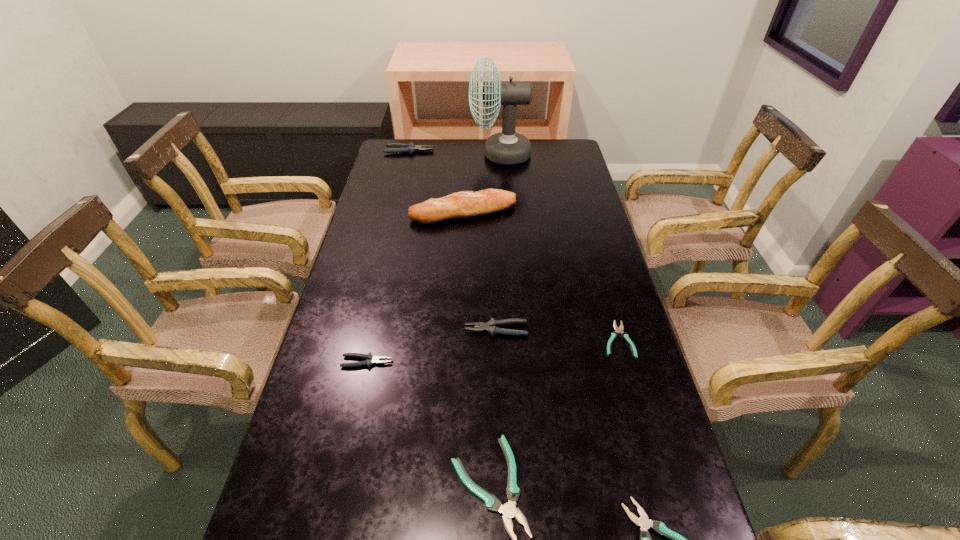
At what (x,y) coordinates should I click in order to perform the action: click on the tallest object. Please return your answer as a coordinate pair (x, y). The width and height of the screenshot is (960, 540). Looking at the image, I should click on (507, 147).

Identify the location of the second tallest object. The height and width of the screenshot is (540, 960). (464, 204).

You are a GUI agent. You are given a task and a screenshot of the screen. Output one action in this format:
    pyautogui.click(x=<x>, y=<y>)
    Task: Click on the baguet
    The width and height of the screenshot is (960, 540).
    Given the screenshot: What is the action you would take?
    pyautogui.click(x=464, y=204)

Locate an element on the screen. The width and height of the screenshot is (960, 540). the third tallest object is located at coordinates (396, 147).

This screenshot has width=960, height=540. I want to click on the tallest pliers, so click(x=396, y=147).

You are a GUI agent. You are given a task and a screenshot of the screen. Output one action in this format:
    pyautogui.click(x=<x>, y=<y>)
    Task: Click on the fifth shortest pliers
    This screenshot has height=540, width=960.
    Given the screenshot: What is the action you would take?
    pyautogui.click(x=491, y=326)

I want to click on the rightmost gray pliers, so click(491, 326).

Identify the location of the smallest gray pliers. (370, 359).

The image size is (960, 540). What are the coordinates of `the shortest pliers` in the screenshot? It's located at (614, 334).

Find the location of a particular element. Image resolution: width=960 pixels, height=540 pixels. the farthest teal pliers is located at coordinates (614, 334).